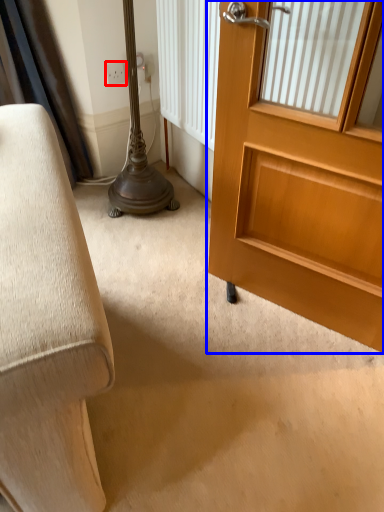
Question: Among these objects, which one is nearest to the camera, electric outlet (highlighted by a red box) or door (highlighted by a blue box)?

Choices:
 (A) electric outlet
 (B) door

Answer: (B)